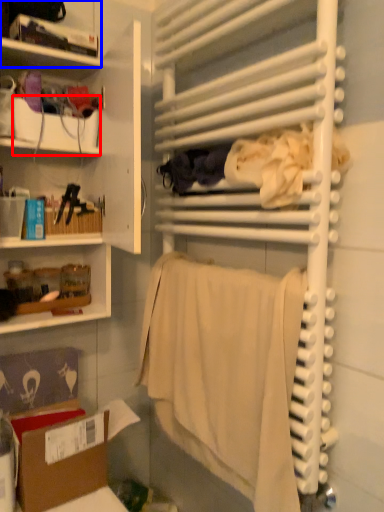
Question: Which object is closer to the camera taking this photo, box (highlighted by a red box) or shelf (highlighted by a blue box)?

Choices:
 (A) box
 (B) shelf

Answer: (B)